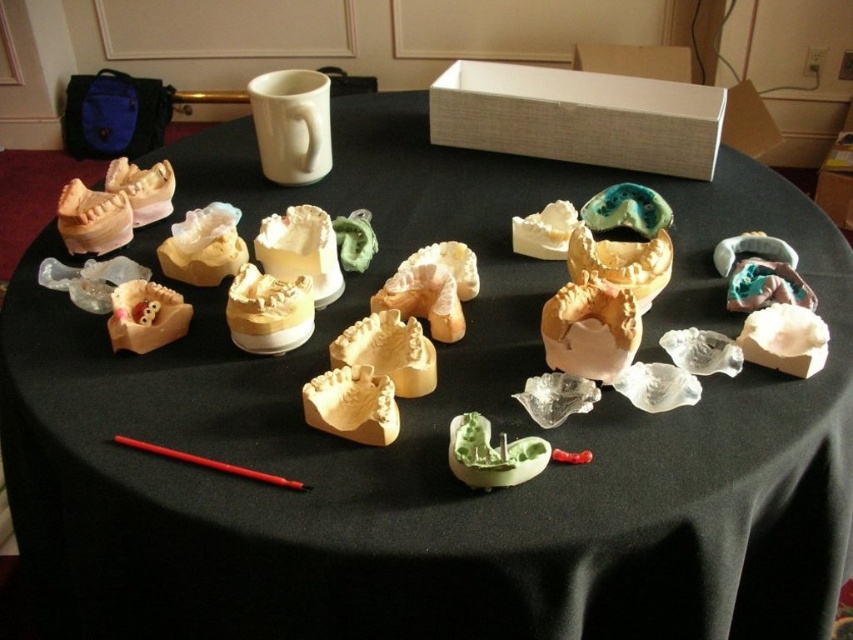
Question: Based on their relative distances, which object is farther from the matte yellow dental mold at center?

Choices:
 (A) green matte mold at center
 (B) matte white plaster cast at center

Answer: (B)

Question: Is matte white plaster cast at center wider than green matte mold at center?

Choices:
 (A) no
 (B) yes

Answer: (B)

Question: Which point is closer to the camera?

Choices:
 (A) (616, 353)
 (B) (490, 472)

Answer: (B)

Question: Does matte white plaster cast at center appear on the right side of green matte mold at center?

Choices:
 (A) no
 (B) yes

Answer: (B)

Question: Which point appears farthest from the camera in this image?

Choices:
 (A) (602, 364)
 (B) (537, 442)
 (C) (357, 435)

Answer: (A)

Question: Does matte white plaster cast at center have a greater width compared to green matte mold at center?

Choices:
 (A) no
 (B) yes

Answer: (B)